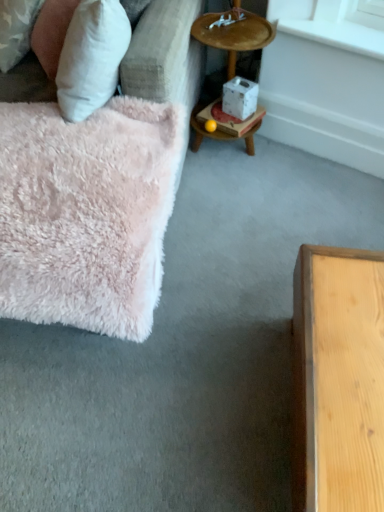
Question: From a real-world perspective, is wooden tray at upper right positioned over white cardboard box at center based on gravity?

Choices:
 (A) no
 (B) yes

Answer: (B)

Question: Would you say wooden tray at upper right is a long distance from white cardboard box at center?

Choices:
 (A) yes
 (B) no

Answer: (B)

Question: Is wooden tray at upper right thinner than white cardboard box at center?

Choices:
 (A) yes
 (B) no

Answer: (B)

Question: Can we say wooden tray at upper right lies outside white cardboard box at center?

Choices:
 (A) no
 (B) yes

Answer: (B)

Question: Is wooden tray at upper right aimed at white cardboard box at center?

Choices:
 (A) no
 (B) yes

Answer: (B)

Question: From the image's perspective, is wooden tray at upper right located beneath white cardboard box at center?

Choices:
 (A) yes
 (B) no

Answer: (B)

Question: Considering the relative positions of wooden tray at upper right and fluffy pink rug at left in the image provided, is wooden tray at upper right to the left of fluffy pink rug at left from the viewer's perspective?

Choices:
 (A) no
 (B) yes

Answer: (A)

Question: Could you tell me if wooden tray at upper right is turned towards fluffy pink rug at left?

Choices:
 (A) no
 (B) yes

Answer: (A)

Question: Is fluffy pink rug at left surrounded by wooden tray at upper right?

Choices:
 (A) yes
 (B) no

Answer: (B)

Question: Can you confirm if wooden tray at upper right is smaller than fluffy pink rug at left?

Choices:
 (A) yes
 (B) no

Answer: (A)

Question: From a real-world perspective, is wooden tray at upper right beneath fluffy pink rug at left?

Choices:
 (A) no
 (B) yes

Answer: (A)

Question: Is wooden tray at upper right further to camera compared to fluffy pink rug at left?

Choices:
 (A) no
 (B) yes

Answer: (B)

Question: Does white smooth window sill at upper right have a larger size compared to fluffy pink rug at left?

Choices:
 (A) no
 (B) yes

Answer: (A)